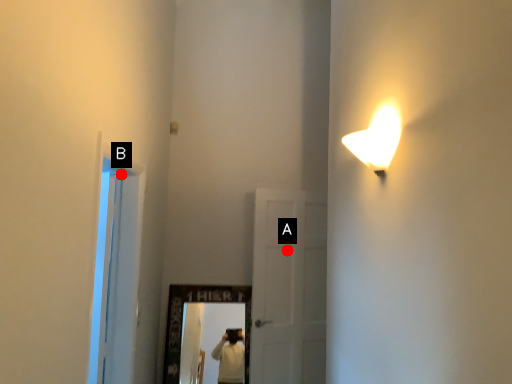
Question: Two points are circled on the image, labeled by A and B beside each circle. Which point is farther from the camera taking this photo?

Choices:
 (A) A is further
 (B) B is further

Answer: (A)